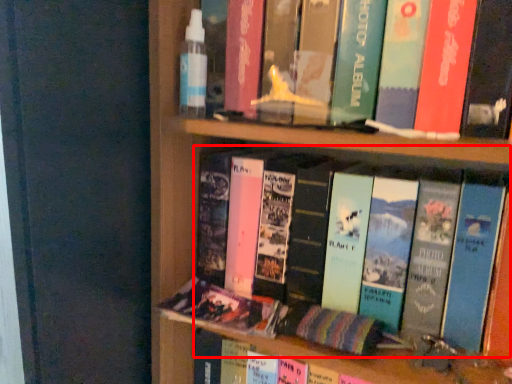
Question: Where is book (annotated by the red box) located in relation to book in the image?

Choices:
 (A) left
 (B) right

Answer: (B)